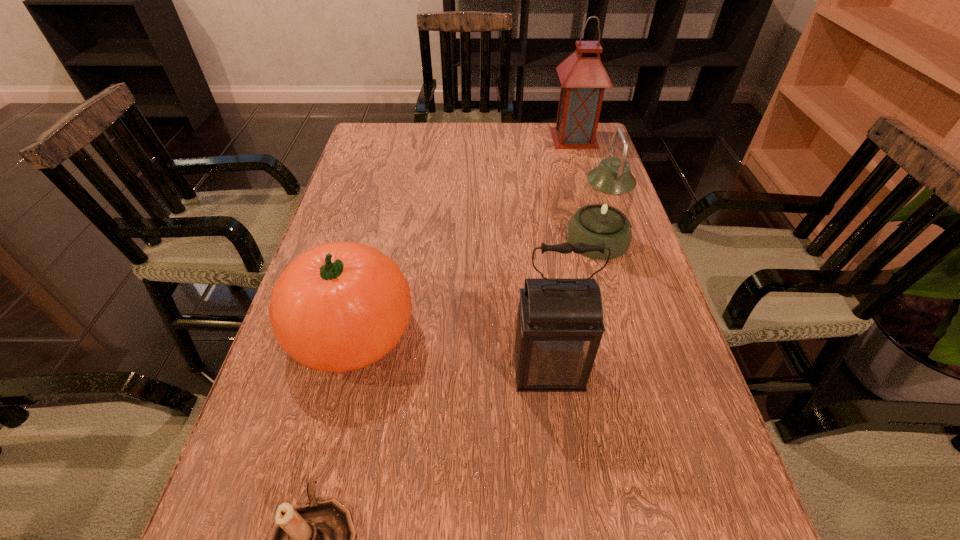
Identify the location of free space between the pumpkin and the farthest lantern. The image size is (960, 540). (463, 235).

I want to click on the closest object relative to the second shortest object, so click(317, 539).

I want to click on object that can be found as the closest to the second farthest object, so click(558, 327).

The width and height of the screenshot is (960, 540). What are the coordinates of `lantern that is the second closest to the nearest lantern` in the screenshot? It's located at (583, 78).

Locate an element on the screen. This screenshot has width=960, height=540. lantern that is the third nearest to the nearest object is located at coordinates point(583,78).

I want to click on vacant space that satisfies the following two spatial constraints: 1. on the back side of the pumpkin; 2. on the right side of the second nearest lantern, so click(x=375, y=238).